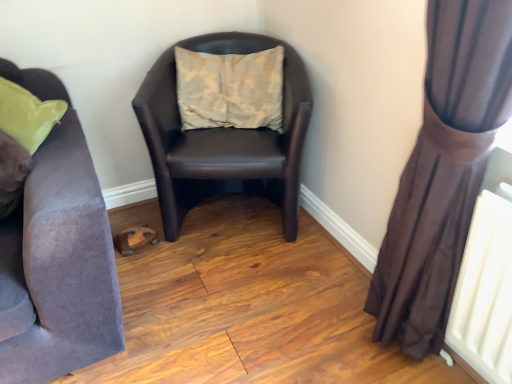
At what (x,y) coordinates should I click in order to perform the action: click on vacant area situated below brown leather chair at center (from a real-world perspective). Please return your answer as a coordinate pair (x, y). Looking at the image, I should click on (238, 216).